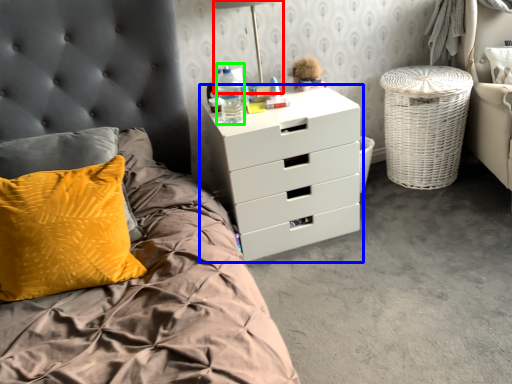
Question: Which object is positioned closest to bedside lamp (highlighted by a red box)? Select from chest of drawers (highlighted by a blue box) and bottle (highlighted by a green box).

Choices:
 (A) chest of drawers
 (B) bottle

Answer: (B)